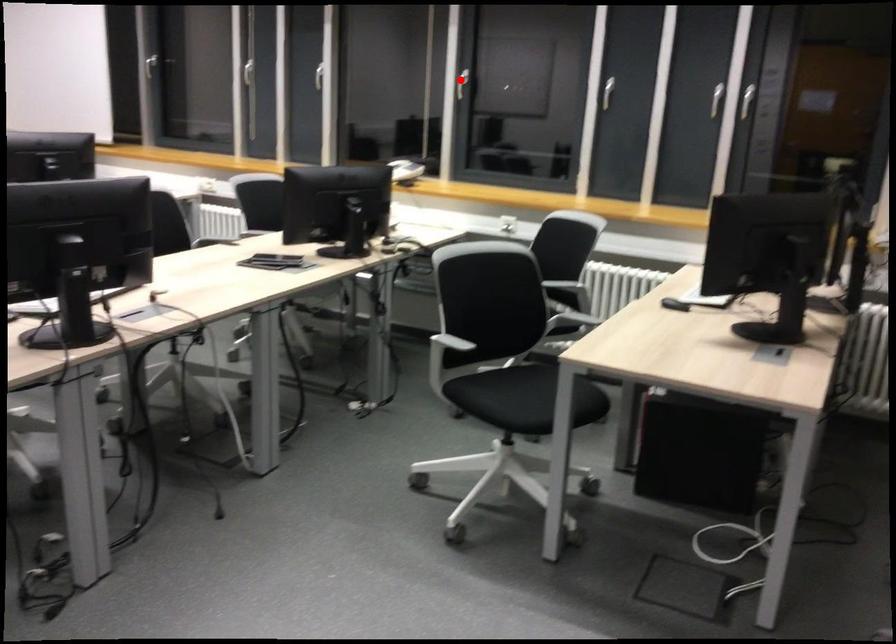
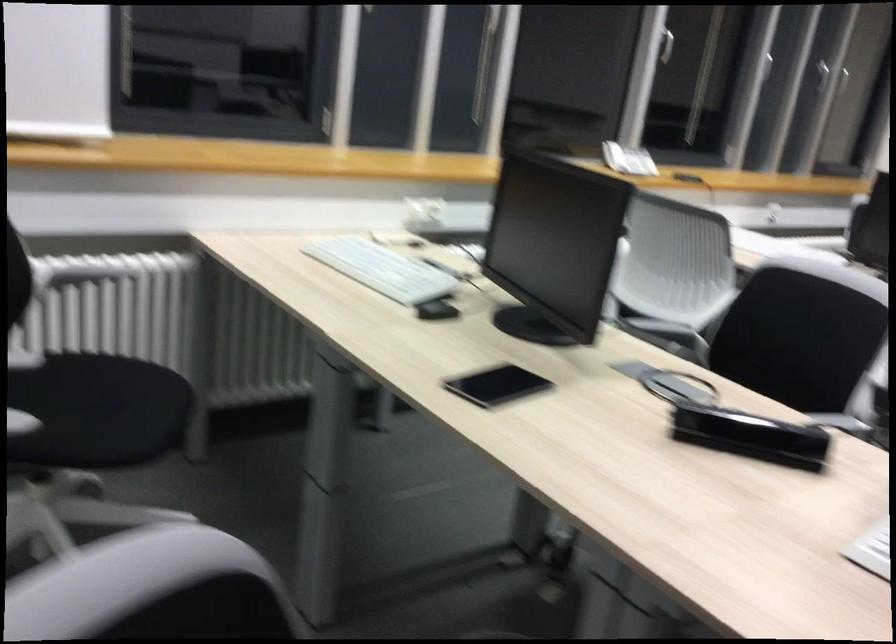
Question: A red point is marked in image1. In image2, is the corresponding 3D point closer to the camera or farther? Reply with the corresponding letter.

Choices:
 (A) The corresponding 3D point is closer.
 (B) The corresponding 3D point is farther.

Answer: (A)